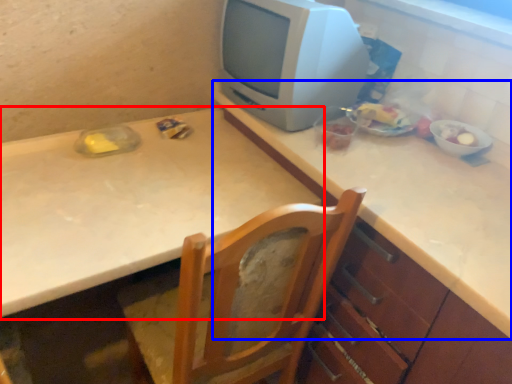
Question: Which of the following is the farthest to the observer, table (highlighted by a red box) or counter top (highlighted by a blue box)?

Choices:
 (A) table
 (B) counter top

Answer: (A)